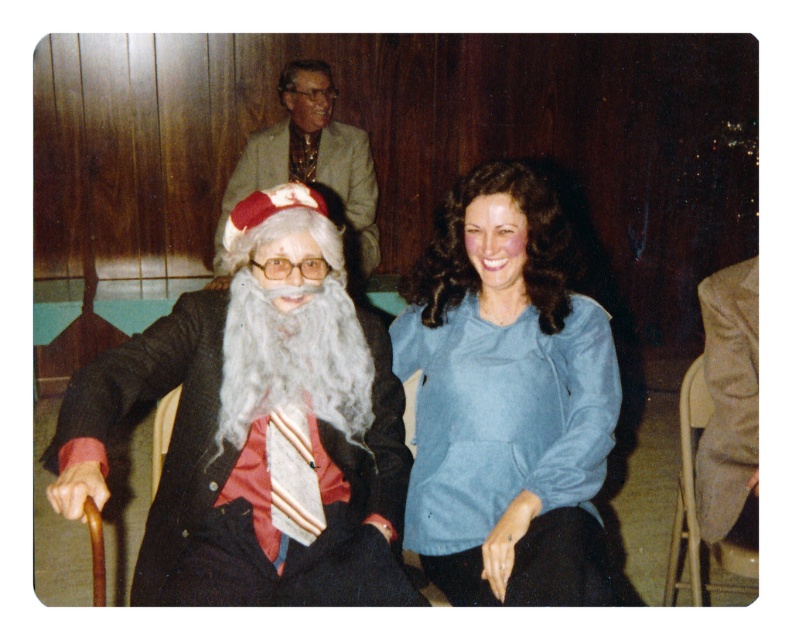
Based on the photo, you are organizing a holiday event and need to ensure there is enough space between the gray fuzzy beard at center and the metallic gray chair at lower right for a small gift box. Based on the image, can the gift box fit between them?

The gray fuzzy beard at center is wider than the metallic gray chair at lower right, so there might not be enough space for the gift box between them.

You are at a festive gathering and see two people dressed in the blue velvety blouse at center and the light brown textured suit at upper center. Which one is positioned more to the right side?

The blue velvety blouse at center is positioned more to the right side than the light brown textured suit at upper center.

You are a photographer trying to capture the Santa figure in the center. The gray fuzzy beard at center is marked by point (292, 358). Where should you focus your camera to ensure the beard is in sharp focus?

You should focus your camera on the point (292, 358) where the gray fuzzy beard at center is located to ensure it is in sharp focus.